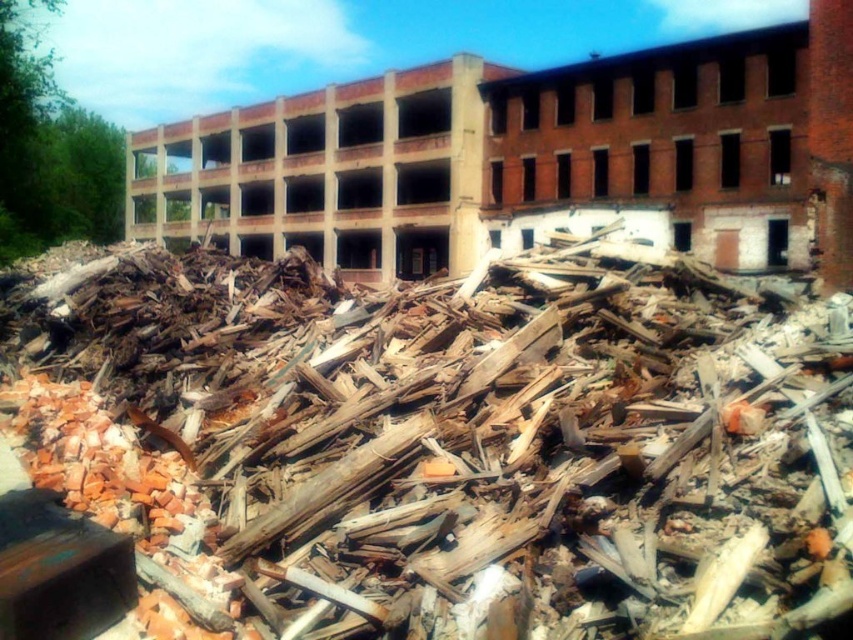
Which of these two, brown wood debris at center or brick rubble at center, stands shorter?

brown wood debris at center

Which is more to the left, brown wood debris at center or brick rubble at center?

Positioned to the left is brick rubble at center.

Image resolution: width=853 pixels, height=640 pixels. Describe the element at coordinates (442, 445) in the screenshot. I see `brown wood debris at center` at that location.

Where is `brown wood debris at center`? Image resolution: width=853 pixels, height=640 pixels. brown wood debris at center is located at coordinates (442, 445).